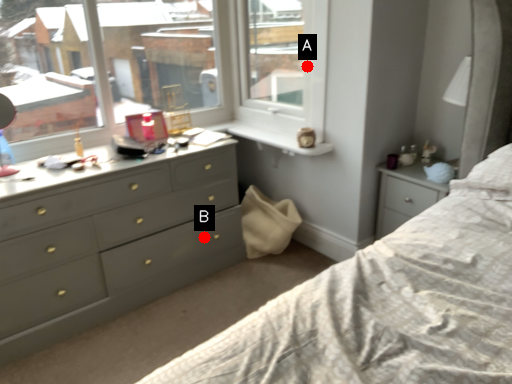
Question: Two points are circled on the image, labeled by A and B beside each circle. Which of the following is the farthest from the observer?

Choices:
 (A) A is further
 (B) B is further

Answer: (B)